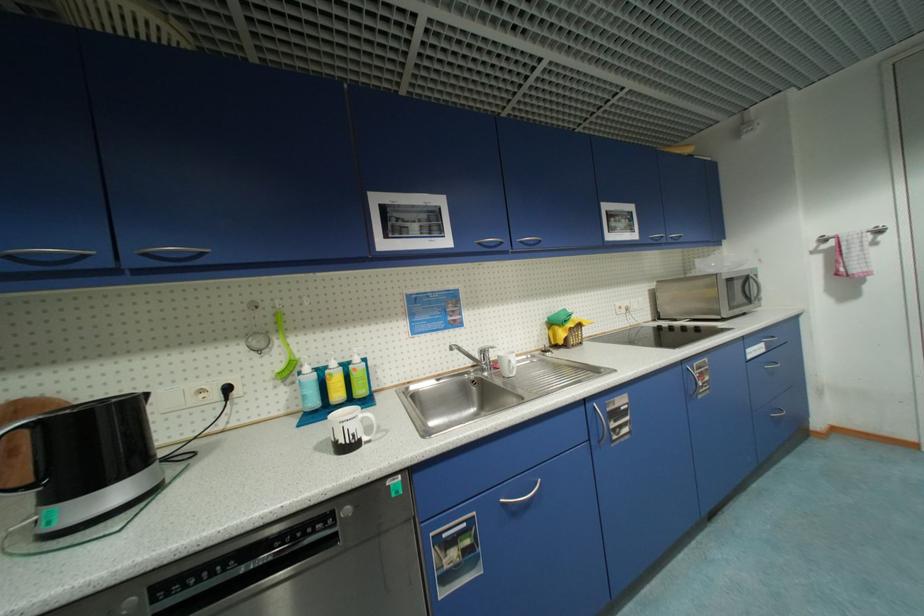
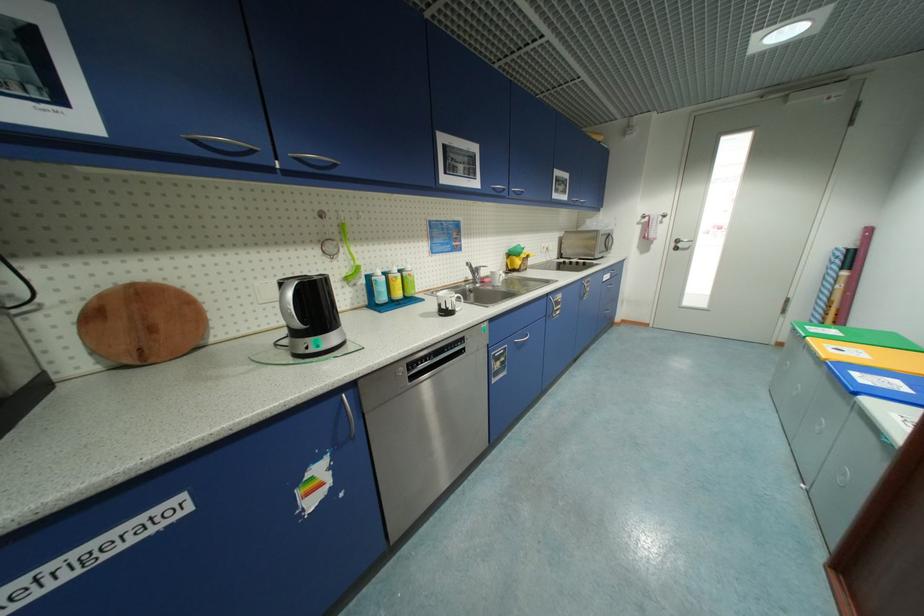
Find the pixel in the second image that matches the point at 283,342 in the first image.

(347, 251)